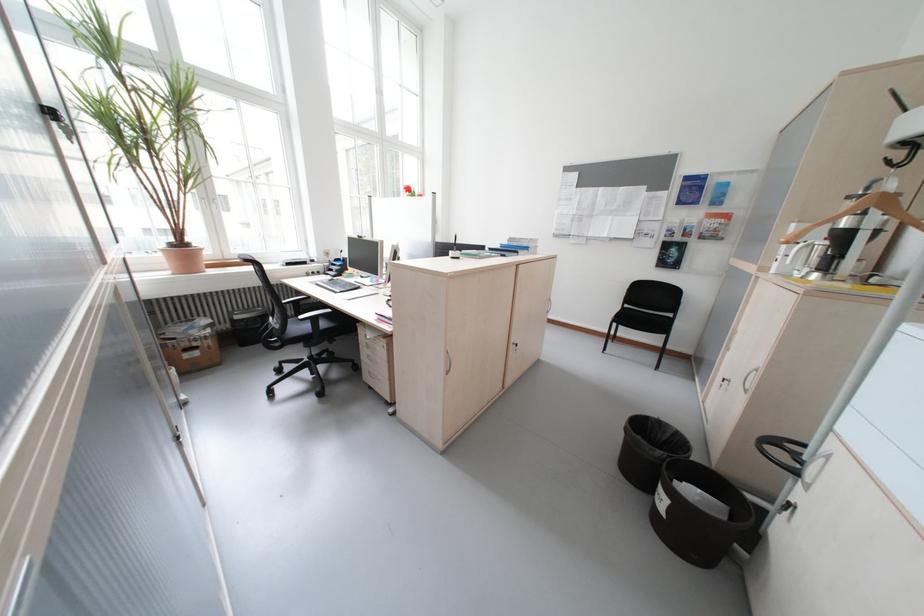
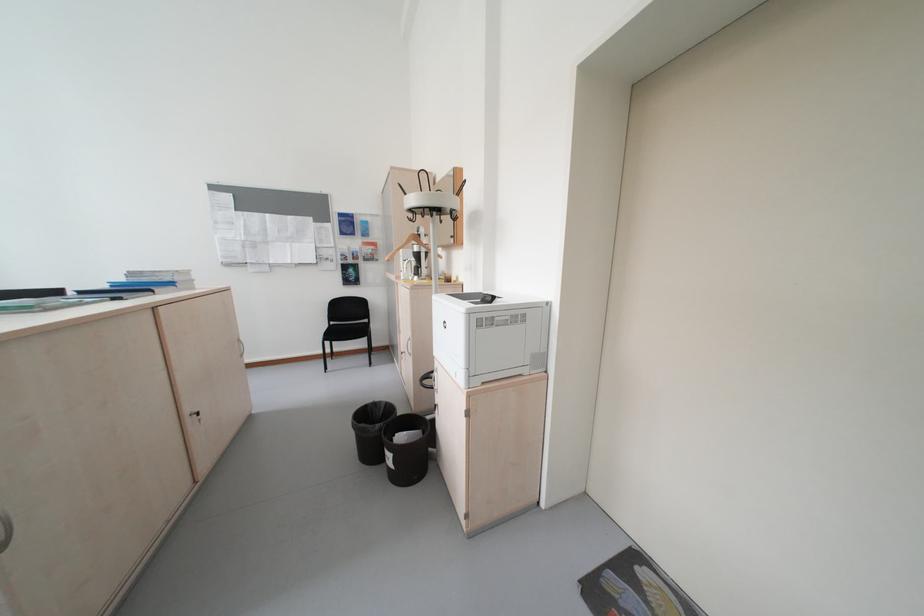
Where in the second image is the point corresponding to (523,347) from the first image?

(200, 421)